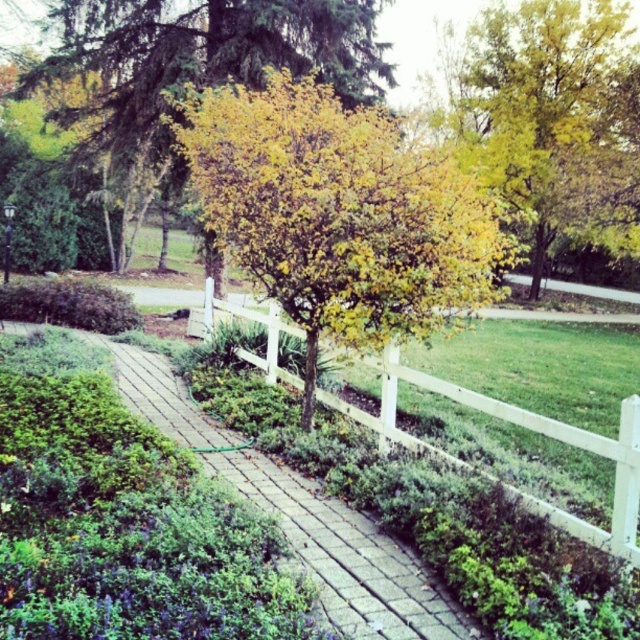
You are standing in the garden and want to take a photo of both the point at coordinates point (628, 6) and point (380, 534). Which point should you focus on first to ensure both are in focus?

You should focus on point (380, 534) first because it is closer to the camera than point (628, 6). By focusing on the closer point, the depth of field may include the farther point as well.